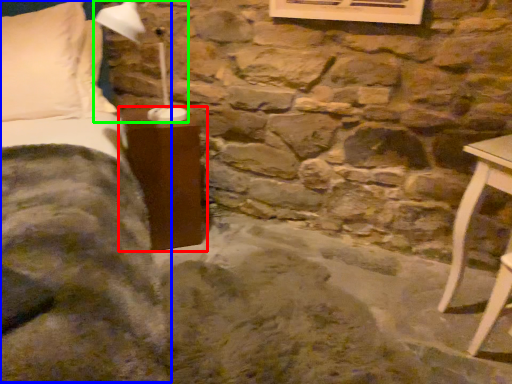
Question: Which object is the farthest from furniture (highlighted by a red box)? Choose among these: bed (highlighted by a blue box) or table lamp (highlighted by a green box).

Choices:
 (A) bed
 (B) table lamp

Answer: (B)